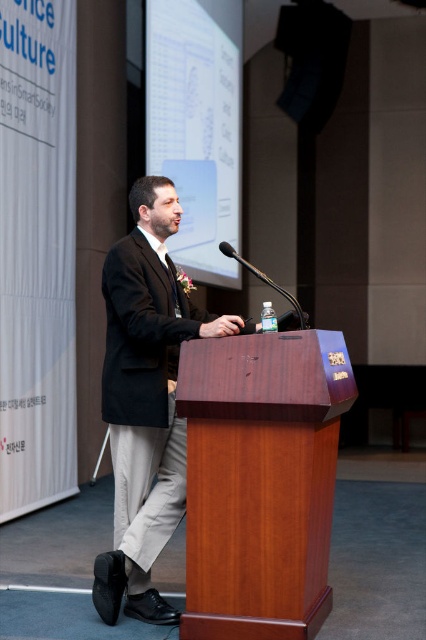
You are a speaker who needs to reach the wooden podium at center to give a speech. You are currently standing 6 feet away from it. Can you walk directly to the podium without needing to move any objects?

The wooden podium at center is 9.09 feet away from the viewer, so you are actually 3.09 feet closer than the stated distance. Since there are no objects mentioned in the scene blocking the path, you can walk directly to the wooden podium at center without needing to move anything.

You are an event planner setting up the stage for a speaker. You need to ensure the speaker wearing the matte black suit at center is visible to the audience. The metallic silver microphone at center is already placed on the podium. Considering their heights, will the microphone block the audience from seeing the speaker?

The matte black suit at center has a greater height compared to the metallic silver microphone at center, so the microphone will not block the audience from seeing the speaker.

You are an event planner setting up a stage for a speaker. You need to ensure there is enough space between the matte black suit at center and the metallic silver microphone at center so that the speaker can move comfortably. Based on the image, can you determine if the current spacing allows for comfortable movement?

The matte black suit at center might be wider than metallic silver microphone at center, so the current spacing may not be sufficient for comfortable movement as the speaker needs enough space to move around without touching the microphone.